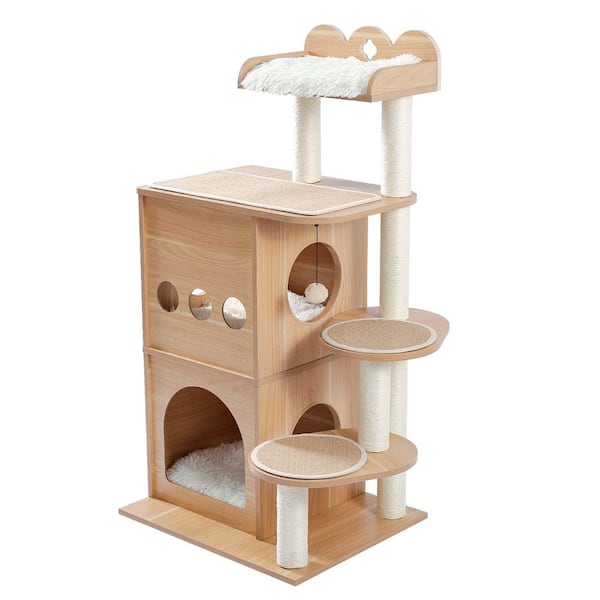
Image resolution: width=600 pixels, height=600 pixels. I want to click on top cushion, so click(x=321, y=68).